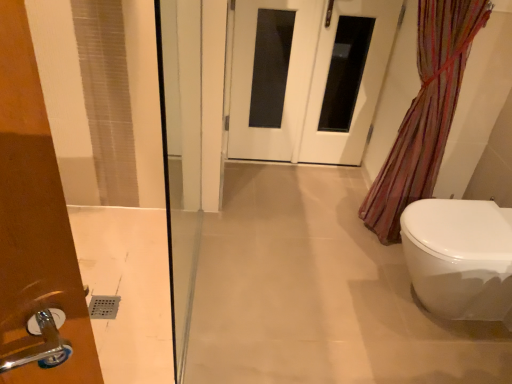
This screenshot has width=512, height=384. Find the location of `free area in between white glossy door at center and translucent striped fabric at right`. free area in between white glossy door at center and translucent striped fabric at right is located at coordinates (309, 196).